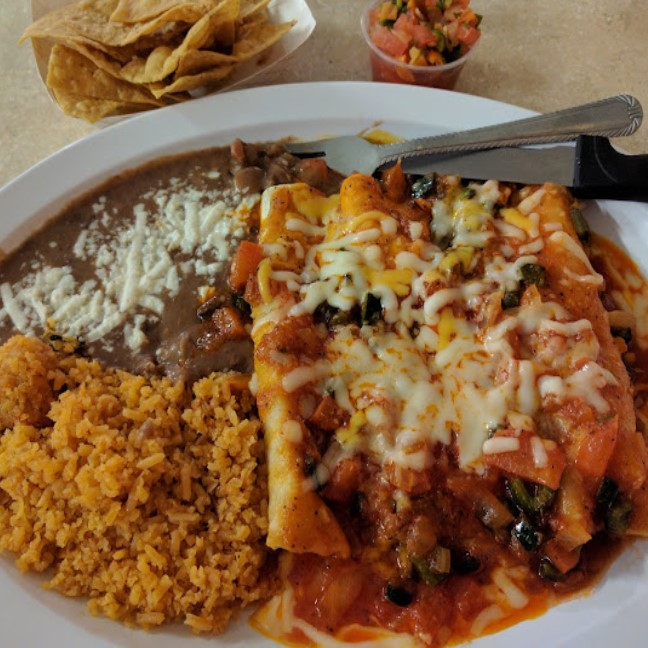
Where is `white dish`? The width and height of the screenshot is (648, 648). white dish is located at coordinates (290, 12).